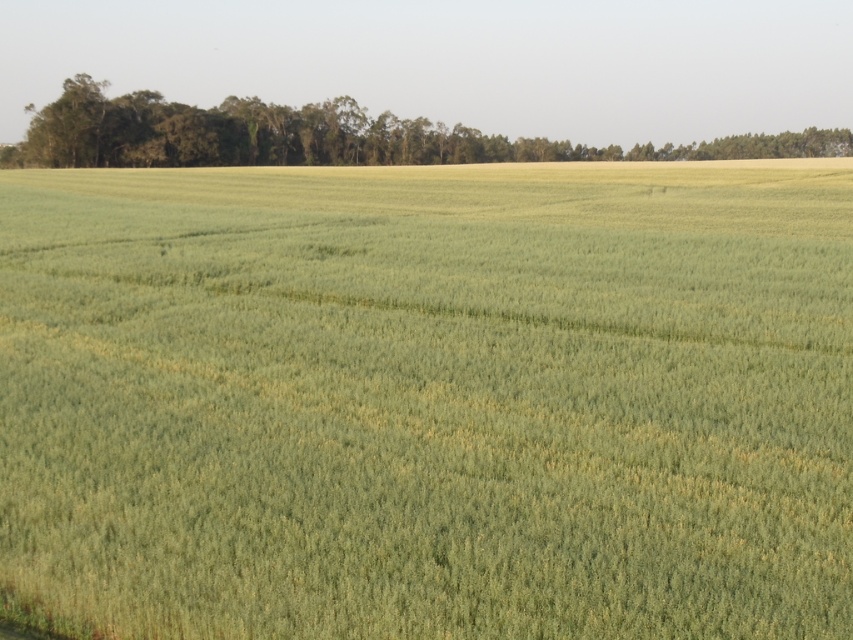
Question: Is green grass at center closer to camera compared to green leafy trees at upper center?

Choices:
 (A) yes
 (B) no

Answer: (A)

Question: Which point is farther to the camera?

Choices:
 (A) green grass at center
 (B) green leafy trees at upper center

Answer: (B)

Question: Is green grass at center wider than green leafy trees at upper center?

Choices:
 (A) yes
 (B) no

Answer: (B)

Question: Considering the relative positions of green grass at center and green leafy trees at upper center in the image provided, where is green grass at center located with respect to green leafy trees at upper center?

Choices:
 (A) above
 (B) below

Answer: (B)